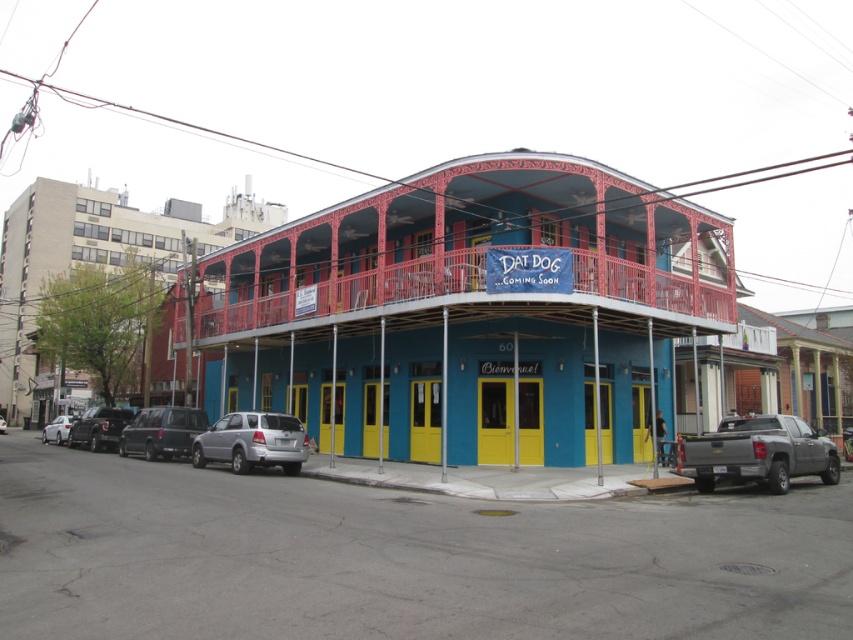
This screenshot has height=640, width=853. What do you see at coordinates (757, 452) in the screenshot? I see `gray metallic truck at lower right` at bounding box center [757, 452].

Where is `gray metallic truck at lower right`? Image resolution: width=853 pixels, height=640 pixels. gray metallic truck at lower right is located at coordinates (757, 452).

Who is more forward, (712, 433) or (282, 456)?

Point (282, 456) is in front.

Is gray metallic truck at lower right taller than satin silver suv at lower left?

In fact, gray metallic truck at lower right may be shorter than satin silver suv at lower left.

Measure the distance between point (x=753, y=448) and camera.

Point (x=753, y=448) and camera are 15.70 meters apart.

Identify the location of gray metallic truck at lower right. Image resolution: width=853 pixels, height=640 pixels. (757, 452).

Is point (705, 476) closer to viewer compared to point (64, 436)?

Yes, it is.

From the picture: Does gray metallic truck at lower right have a greater height compared to white matte car at lower left?

No.

The image size is (853, 640). I want to click on gray metallic truck at lower right, so click(x=757, y=452).

Identify the location of gray metallic truck at lower right. This screenshot has height=640, width=853. (757, 452).